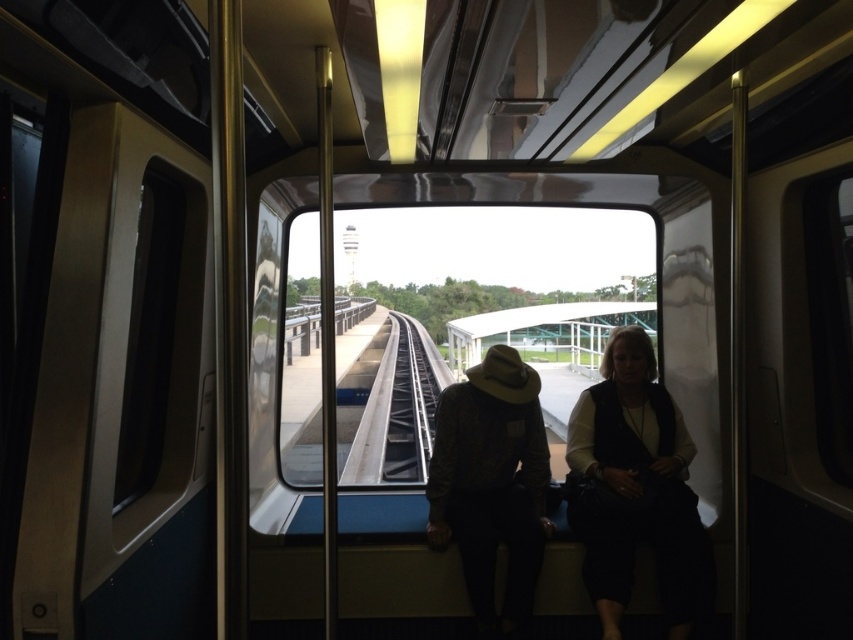
Does point (618, 346) come behind point (397, 355)?

No, (618, 346) is in front of (397, 355).

Describe the element at coordinates (637, 490) in the screenshot. I see `black fabric vest at right` at that location.

Find the location of a particular element. black fabric vest at right is located at coordinates (637, 490).

Can you confirm if transparent glass train window at center is positioned above leather hat at center?

Yes, transparent glass train window at center is above leather hat at center.

Is point (404, 429) closer to camera compared to point (527, 474)?

No.

Locate an element on the screen. This screenshot has height=640, width=853. transparent glass train window at center is located at coordinates (473, 314).

The width and height of the screenshot is (853, 640). I want to click on transparent glass train window at center, so click(x=473, y=314).

Does point (556, 394) come farther from viewer compared to point (675, 566)?

That is True.

This screenshot has height=640, width=853. What do you see at coordinates (473, 314) in the screenshot? I see `transparent glass train window at center` at bounding box center [473, 314].

This screenshot has width=853, height=640. Identify the location of transparent glass train window at center. pos(473,314).